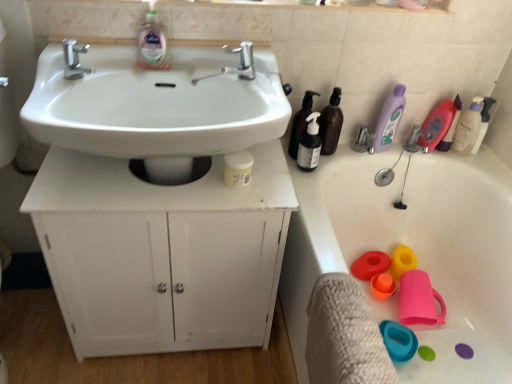
You are a GUI agent. You are given a task and a screenshot of the screen. Output one action in this format:
    pyautogui.click(x=<x>, y=<y>)
    Task: Click on the free spot to the right of white matte jar at center, which is the 1th toiletry in bottom-to-top order
    The width and height of the screenshot is (512, 384).
    Given the screenshot: What is the action you would take?
    pyautogui.click(x=271, y=184)